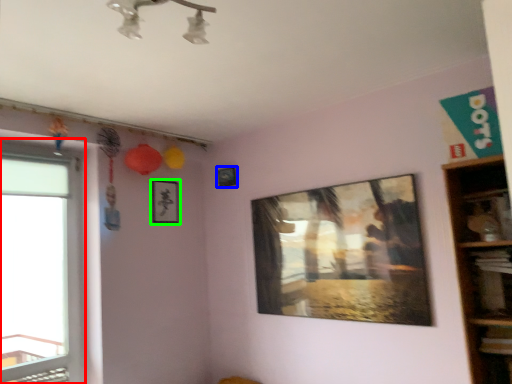
Question: Considering the real-world distances, which object is closest to window (highlighted by a red box)? picture frame (highlighted by a blue box) or picture frame (highlighted by a green box).

Choices:
 (A) picture frame
 (B) picture frame

Answer: (B)